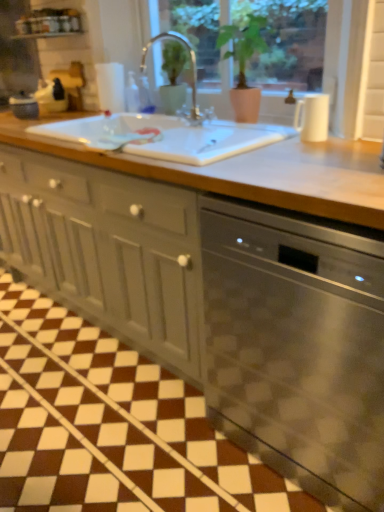
Locate an element on the screen. vacant space in front of matte gray cabinet at center is located at coordinates (92, 403).